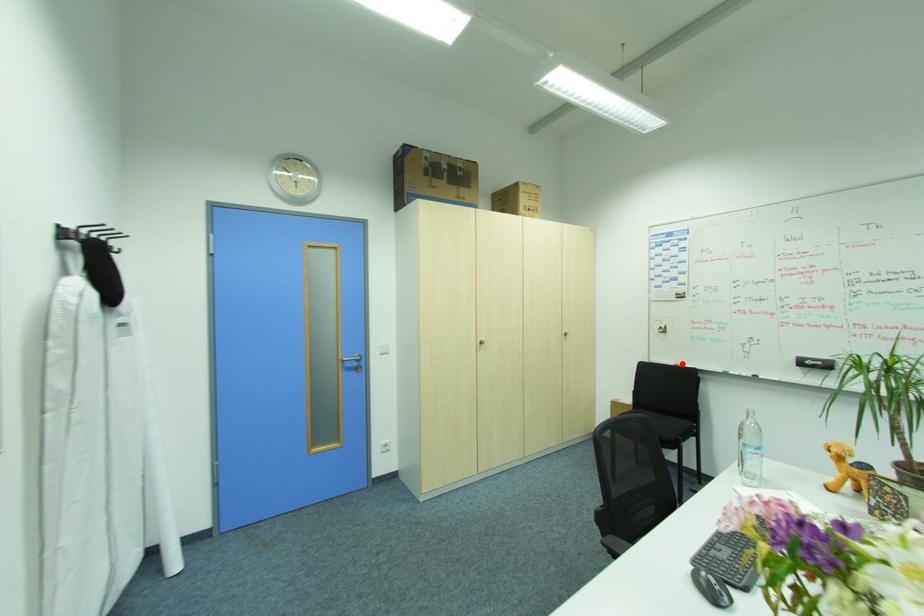
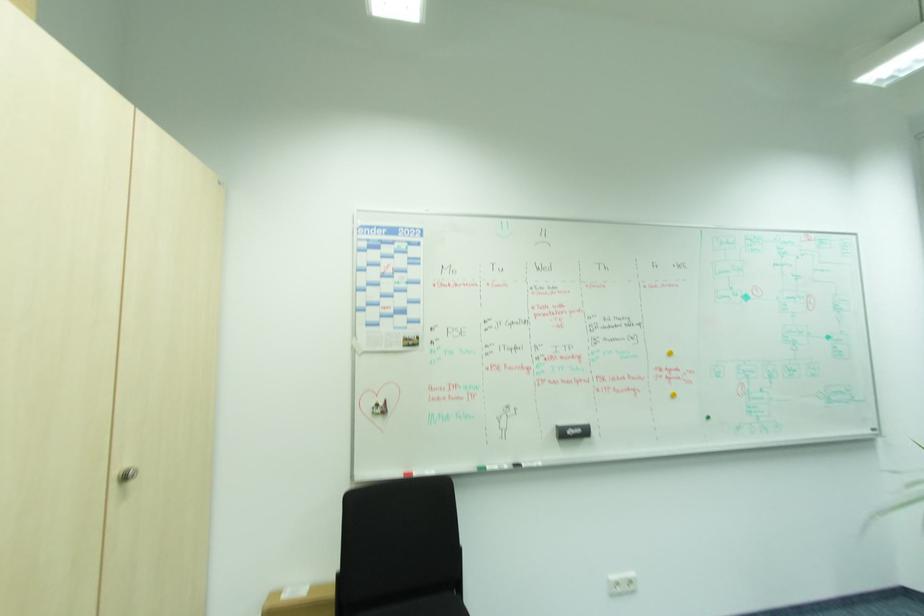
In the second image, find the point that corresponds to the highlighted location in the first image.

(412, 469)